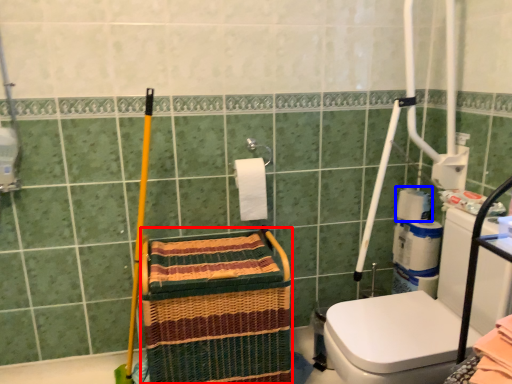
Question: Which point is closer to the camera, basket (highlighted by a red box) or toilet paper (highlighted by a blue box)?

Choices:
 (A) basket
 (B) toilet paper

Answer: (A)